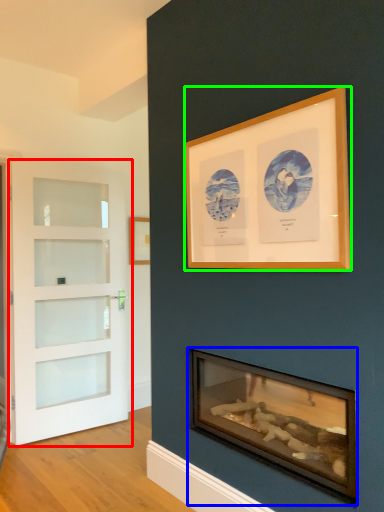
Question: Which object is the farthest from door (highlighted by a red box)? Choose among these: wood burning stove (highlighted by a blue box) or picture frame (highlighted by a green box).

Choices:
 (A) wood burning stove
 (B) picture frame

Answer: (B)